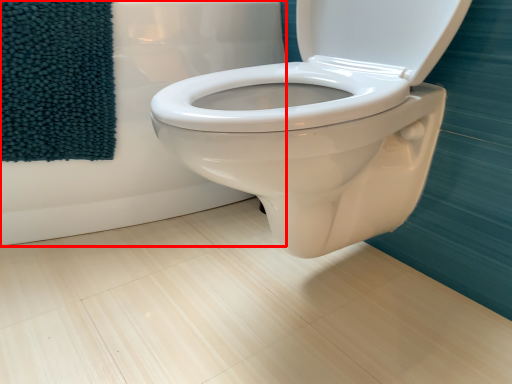
Question: From the image's perspective, what is the correct spatial relationship of bath (annotated by the red box) in relation to beach towel?

Choices:
 (A) below
 (B) above

Answer: (B)